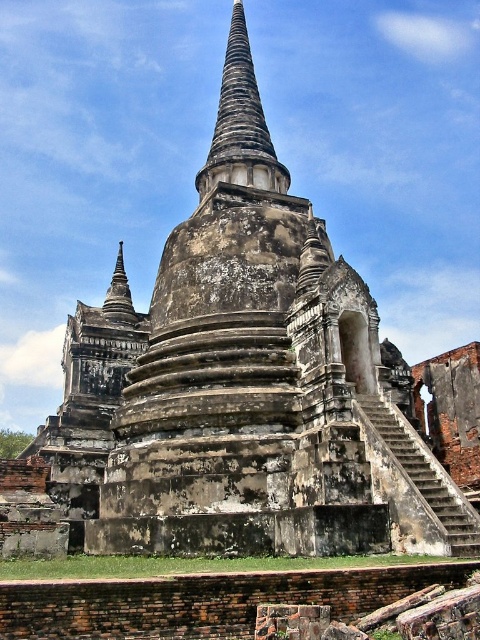
Question: Which object appears farthest from the camera in this image?

Choices:
 (A) dark brown stone spire at upper left
 (B) weathered stone spire at center

Answer: (A)

Question: Among these objects, which one is nearest to the camera?

Choices:
 (A) weathered stone spire at center
 (B) dark brown stone spire at upper left

Answer: (A)

Question: Where is weathered stone spire at center located in relation to dark brown stone spire at upper left in the image?

Choices:
 (A) below
 (B) above

Answer: (B)

Question: Which object appears farthest from the camera in this image?

Choices:
 (A) weathered stone spire at center
 (B) dark brown stone spire at upper left

Answer: (B)

Question: Does weathered stone spire at center appear on the left side of dark brown stone spire at upper left?

Choices:
 (A) yes
 (B) no

Answer: (B)

Question: Is weathered stone spire at center wider than dark brown stone spire at upper left?

Choices:
 (A) no
 (B) yes

Answer: (B)